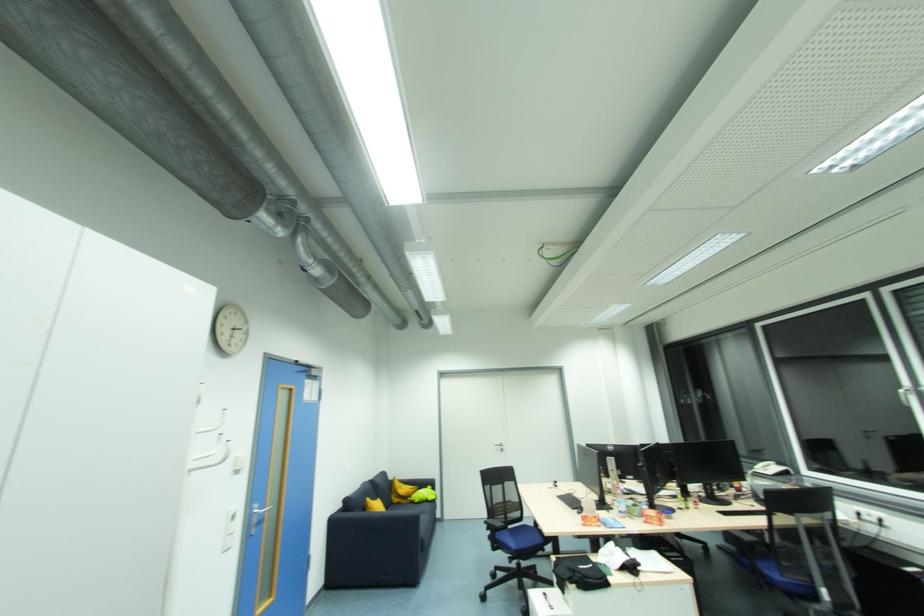
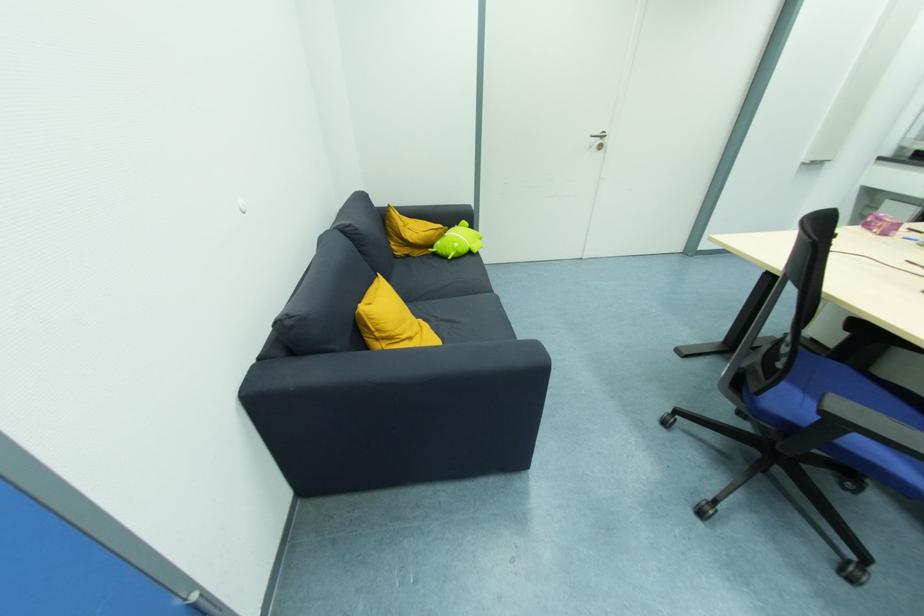
Locate, in the second image, the point that corresponds to [397,501] in the first image.

(403, 253)